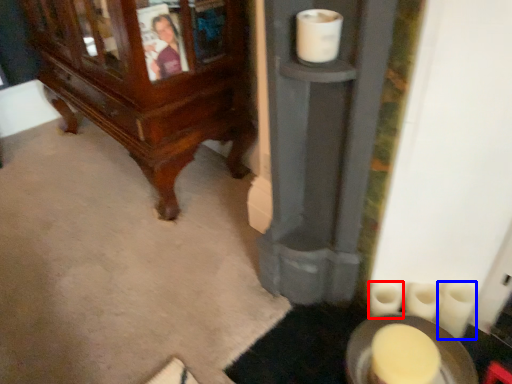
Question: Which object appears closest to the camera in this image, toilet paper (highlighted by a red box) or toilet paper (highlighted by a blue box)?

Choices:
 (A) toilet paper
 (B) toilet paper

Answer: (B)